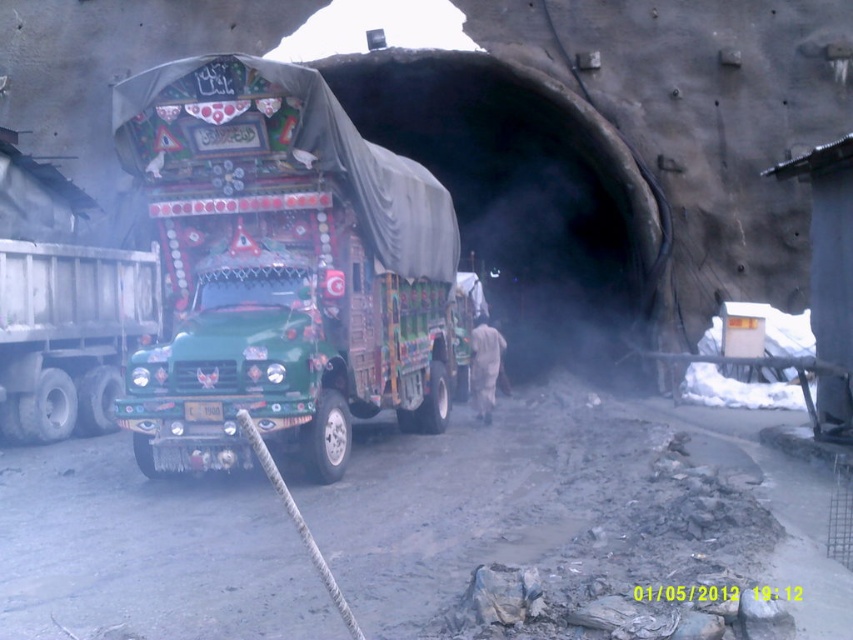
Question: Which is nearer to the green painted truck at center?

Choices:
 (A) dark concrete tunnel at center
 (B) green matte trailer truck at left

Answer: (B)

Question: Is dark concrete tunnel at center above green matte trailer truck at left?

Choices:
 (A) yes
 (B) no

Answer: (A)

Question: Considering the real-world distances, which object is farthest from the green painted truck at center?

Choices:
 (A) green matte trailer truck at left
 (B) dark concrete tunnel at center

Answer: (B)

Question: Is green painted truck at center to the right of green matte trailer truck at left from the viewer's perspective?

Choices:
 (A) no
 (B) yes

Answer: (B)

Question: Which of the following is the closest to the observer?

Choices:
 (A) pyautogui.click(x=350, y=321)
 (B) pyautogui.click(x=508, y=296)
 (C) pyautogui.click(x=73, y=301)

Answer: (A)

Question: Does green painted truck at center appear over green matte trailer truck at left?

Choices:
 (A) no
 (B) yes

Answer: (B)